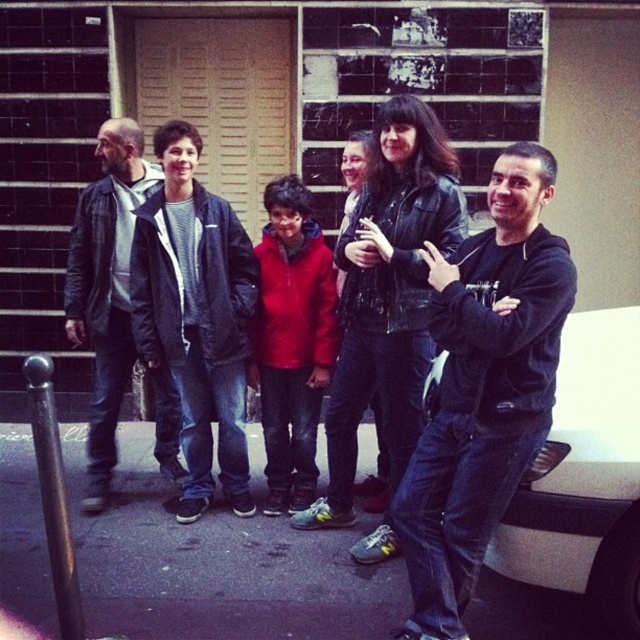
You are a photographer trying to adjust the group photo so that the leather jacket at center and the dark blue jacket at center are arranged symmetrically. Which jacket should be moved to the left to achieve this symmetry?

The leather jacket at center should be moved to the left to align symmetrically with the dark blue jacket at center since it is currently positioned to the right of it.

You are standing in front of the building and want to place a small flag exactly halfway between the two points marked as point (620, 321) and point (113, 266). Considering their positions, will the flag be closer to the building or the open space in front of it?

The flag placed halfway between point (620, 321) and point (113, 266) will be closer to the open space in front of the building because point (620, 321) is closer to the viewer than point (113, 266), so the midpoint leans towards the viewer side.

You are standing in front of the building and notice two jackets worn by people in the group. The leather jacket at center and the dark blue jacket at center. Which jacket is positioned in front of the other?

The leather jacket at center is closer to the viewer than the dark blue jacket at center, so the leather jacket at center is positioned in front of the dark blue jacket at center.